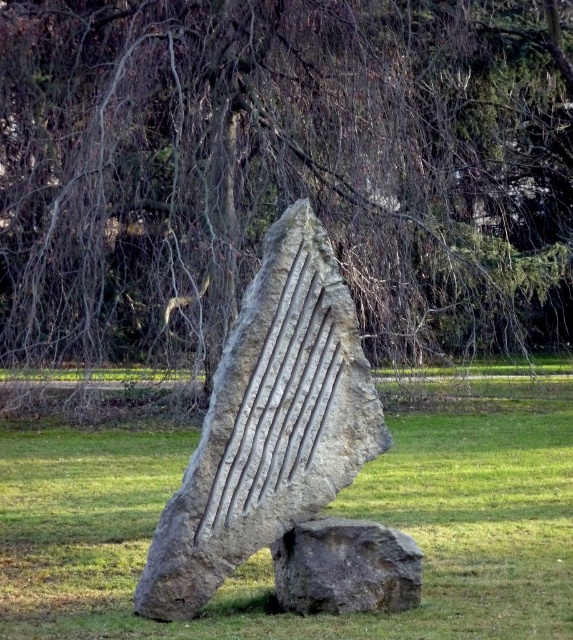
You are an artist planning to create a miniature version of the sculpture. You have two materials available, one that can handle larger widths and another for smaller details. Which material should you use for the natural stone sculpture at center and which for the gray stone sculpture at center?

The natural stone sculpture at center has a larger width than the gray stone sculpture at center, so you should use the material that can handle larger widths for the natural stone sculpture at center and the material for smaller details for the gray stone sculpture at center.

You are standing at the edge of the grassy area and want to place a 2 feet wide bench between the natural stone sculpture at center and the gray stone sculpture at center. Is there enough space to fit the bench between them?

The natural stone sculpture at center and the gray stone sculpture at center are 7.31 feet apart. Since the bench is only 2 feet wide, there is sufficient space to place it between them.

You are an artist planning to paint a landscape that includes the bare branches at center and the natural stone sculpture at center. Which object should you depict as having a more slender appearance?

The bare branches at center should be depicted as more slender since they are thinner than the natural stone sculpture at center.